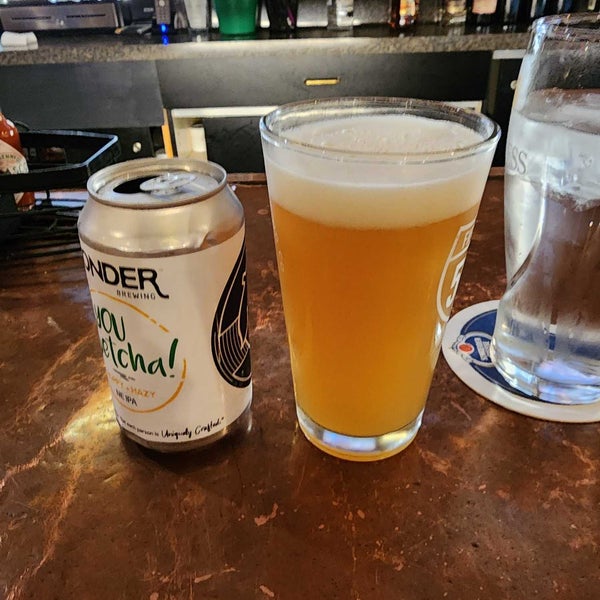
Identify the location of foam. The width and height of the screenshot is (600, 600). (406, 197).